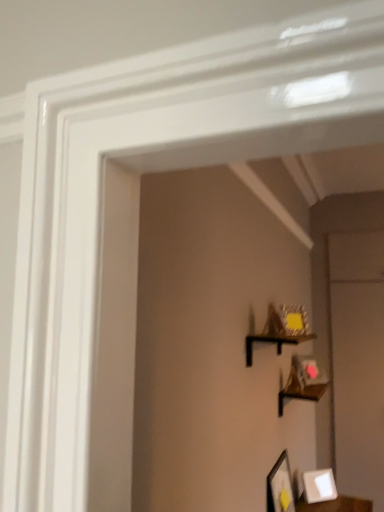
Question: Can you confirm if matte black picture frame at lower right, positioned as the second picture frame in back-to-front order, is taller than white matte picture frame at lower right, arranged as the first picture frame when viewed from the right?

Choices:
 (A) yes
 (B) no

Answer: (A)

Question: Considering the relative sizes of matte black picture frame at lower right, the 1th picture frame in the left-to-right sequence, and white matte picture frame at lower right, arranged as the first picture frame when viewed from the right, in the image provided, is matte black picture frame at lower right, the 1th picture frame in the left-to-right sequence, smaller than white matte picture frame at lower right, arranged as the first picture frame when viewed from the right,?

Choices:
 (A) no
 (B) yes

Answer: (A)

Question: Does matte black picture frame at lower right, positioned as the second picture frame in back-to-front order, have a greater width compared to white matte picture frame at lower right, the 2th picture frame when ordered from front to back?

Choices:
 (A) yes
 (B) no

Answer: (B)

Question: Is white matte picture frame at lower right, the 2th picture frame when ordered from front to back, completely or partially inside matte black picture frame at lower right, positioned as the second picture frame in back-to-front order?

Choices:
 (A) no
 (B) yes

Answer: (A)

Question: Is matte black picture frame at lower right, the 1th picture frame in the left-to-right sequence, turned away from white matte picture frame at lower right, acting as the 1th picture frame starting from the back?

Choices:
 (A) yes
 (B) no

Answer: (B)

Question: From the image's perspective, would you say matte black picture frame at lower right, the 1th picture frame in the left-to-right sequence, is shown under white matte picture frame at lower right, which ranks as the second picture frame in left-to-right order?

Choices:
 (A) yes
 (B) no

Answer: (B)

Question: Can you confirm if black matte shelf at upper center is smaller than white matte picture frame at lower right, arranged as the first picture frame when viewed from the right?

Choices:
 (A) yes
 (B) no

Answer: (B)

Question: Is black matte shelf at upper center surrounding white matte picture frame at lower right, acting as the 1th picture frame starting from the back?

Choices:
 (A) no
 (B) yes

Answer: (A)

Question: Considering the relative sizes of black matte shelf at upper center and white matte picture frame at lower right, the 2th picture frame when ordered from front to back, in the image provided, is black matte shelf at upper center thinner than white matte picture frame at lower right, the 2th picture frame when ordered from front to back,?

Choices:
 (A) no
 (B) yes

Answer: (A)

Question: Is black matte shelf at upper center oriented away from white matte picture frame at lower right, the 2th picture frame when ordered from front to back?

Choices:
 (A) no
 (B) yes

Answer: (A)

Question: From a real-world perspective, is black matte shelf at upper center located higher than white matte picture frame at lower right, acting as the 1th picture frame starting from the back?

Choices:
 (A) no
 (B) yes

Answer: (B)

Question: Are black matte shelf at upper center and white matte picture frame at lower right, which ranks as the second picture frame in left-to-right order, beside each other?

Choices:
 (A) yes
 (B) no

Answer: (B)

Question: Is white matte picture frame at lower right, acting as the 1th picture frame starting from the back, next to black matte shelf at upper center?

Choices:
 (A) yes
 (B) no

Answer: (B)